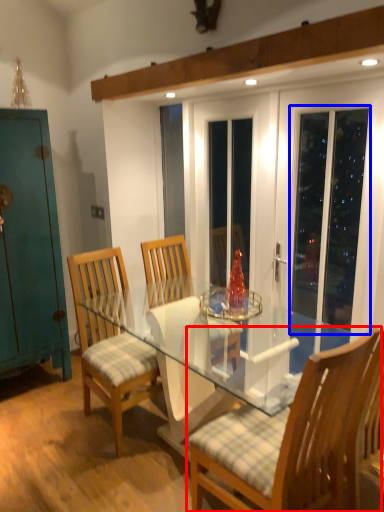
Question: Which object is closer to the camera taking this photo, chair (highlighted by a red box) or screen door (highlighted by a blue box)?

Choices:
 (A) chair
 (B) screen door

Answer: (A)